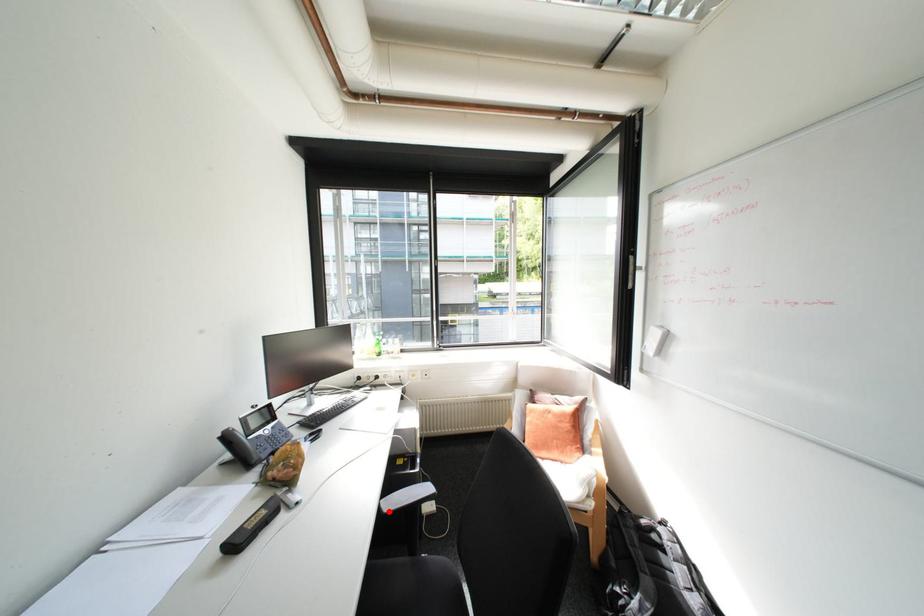
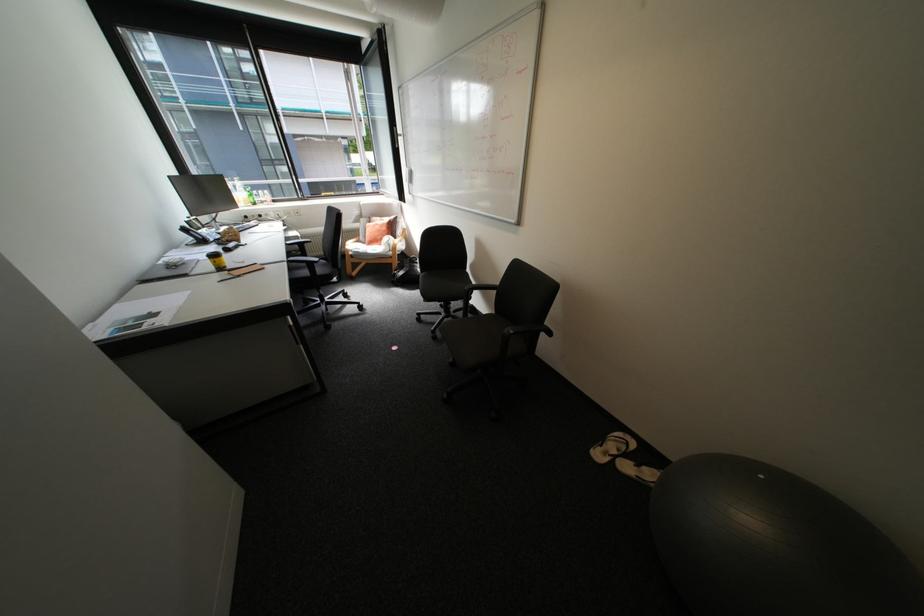
In the second image, find the point that corresponds to the highlighted location in the first image.

(296, 244)